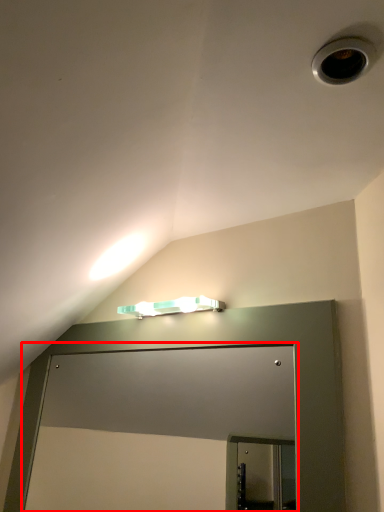
Question: From the image's perspective, what is the correct spatial relationship of glass door (annotated by the red box) in relation to lamp?

Choices:
 (A) below
 (B) above

Answer: (A)